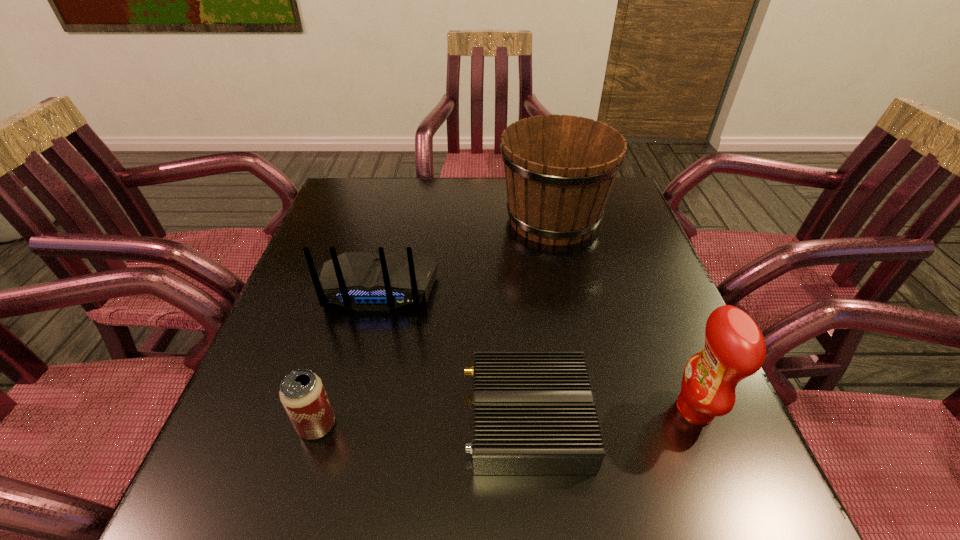
Where is `wine bucket that is at the right edge`? The width and height of the screenshot is (960, 540). wine bucket that is at the right edge is located at coordinates (559, 170).

Find the location of `condiment at the right edge`. condiment at the right edge is located at coordinates (734, 349).

Find the location of a particular element. Image resolution: width=960 pixels, height=540 pixels. object at the far right corner is located at coordinates (559, 170).

Where is `vacant space at the far edge`? vacant space at the far edge is located at coordinates (429, 216).

At what (x,y) coordinates should I click in order to perform the action: click on blank space at the near edge. Please return your answer as a coordinate pair (x, y). The image size is (960, 540). Looking at the image, I should click on (594, 526).

This screenshot has height=540, width=960. Find the location of `vacant space at the left edge of the desktop`. vacant space at the left edge of the desktop is located at coordinates pos(337,362).

Find the location of a particular element. The height and width of the screenshot is (540, 960). vacant area at the right edge is located at coordinates coord(618,350).

In the image, there is a desktop. Identify the location of vacant area at the far left corner. This screenshot has width=960, height=540. (379, 192).

Locate an element on the screen. This screenshot has width=960, height=540. free region at the near left corner of the desktop is located at coordinates (185, 511).

Locate an element on the screen. free space between the shorter router and the beer can is located at coordinates (422, 423).